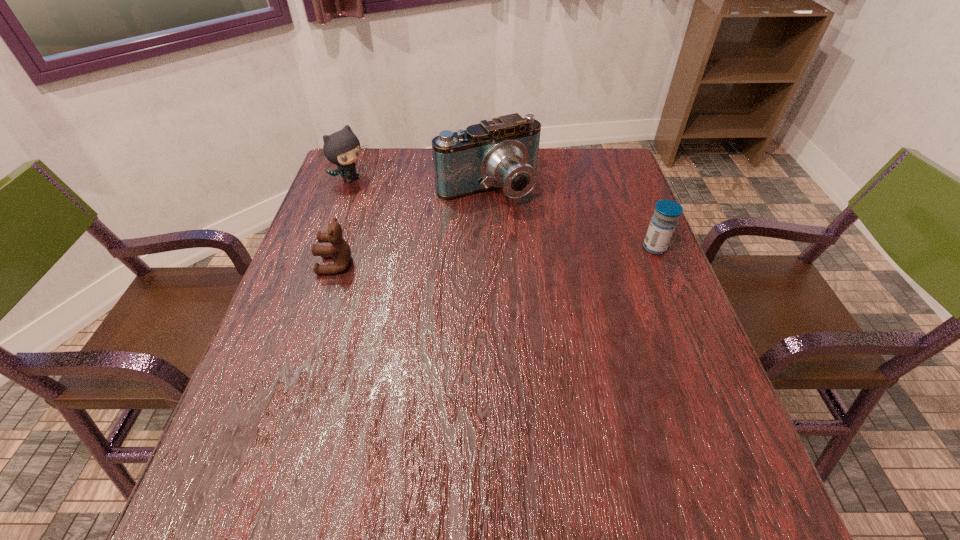
Where is `free space between the second tallest object and the teddy bear`? free space between the second tallest object and the teddy bear is located at coordinates (344, 222).

You are a GUI agent. You are given a task and a screenshot of the screen. Output one action in this format:
    pyautogui.click(x=<x>, y=<y>)
    Task: Click on the unoccupied position between the medicine and the teddy bear
    
    Given the screenshot: What is the action you would take?
    pyautogui.click(x=495, y=256)

This screenshot has height=540, width=960. Find the location of `vacant space that's between the teddy bear and the third object from left to right`. vacant space that's between the teddy bear and the third object from left to right is located at coordinates (412, 226).

This screenshot has width=960, height=540. What are the coordinates of `vacant area that lies between the rightmost object and the third object from left to right` in the screenshot? It's located at (571, 218).

Locate an element on the screen. object that can be found as the closest to the kitten is located at coordinates point(502,153).

Select which object is the second closest to the rightmost object. Please provide its 2D coordinates. Your answer should be formatted as a tuple, i.e. [(x, y)], where the tuple contains the x and y coordinates of a point satisfying the conditions above.

[(340, 251)]

Find the location of a particular element. This screenshot has width=960, height=540. vacant space that satisfies the following two spatial constraints: 1. on the front side of the medicine; 2. on the right side of the second object from right to left is located at coordinates (489, 247).